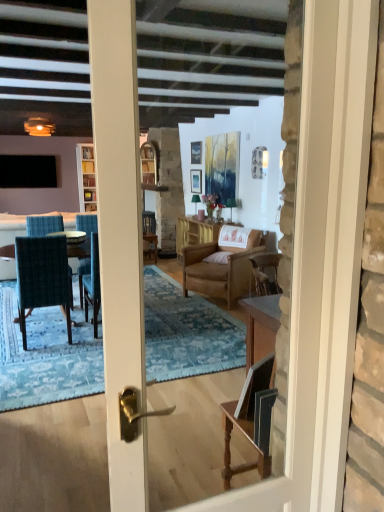
Question: Can you confirm if clear glass cabinet at center is taller than brown leather armchair at center, acting as the second chair starting from the front?

Choices:
 (A) yes
 (B) no

Answer: (B)

Question: From a real-world perspective, is clear glass cabinet at center on brown leather armchair at center, acting as the second chair starting from the front?

Choices:
 (A) no
 (B) yes

Answer: (B)

Question: Is clear glass cabinet at center completely or partially outside of brown leather armchair at center, marked as the second chair in a left-to-right arrangement?

Choices:
 (A) no
 (B) yes

Answer: (B)

Question: Is clear glass cabinet at center wider than brown leather armchair at center, marked as the 1th chair in a back-to-front arrangement?

Choices:
 (A) no
 (B) yes

Answer: (A)

Question: From the image's perspective, is clear glass cabinet at center located above brown leather armchair at center, acting as the second chair starting from the front?

Choices:
 (A) yes
 (B) no

Answer: (A)

Question: Is clear glass cabinet at center aimed at brown leather armchair at center, marked as the 1th chair in a back-to-front arrangement?

Choices:
 (A) yes
 (B) no

Answer: (B)

Question: Does teal fabric chair at left, placed as the first chair when sorted from left to right, appear on the right side of matte wooden picture frame at center, which is counted as the 2th picture frame, starting from the top?

Choices:
 (A) no
 (B) yes

Answer: (A)

Question: Is matte wooden picture frame at center, which is counted as the 2th picture frame, starting from the top, completely or partially inside teal fabric chair at left, placed as the first chair when sorted from left to right?

Choices:
 (A) yes
 (B) no

Answer: (B)

Question: From the image's perspective, is teal fabric chair at left, the 2th chair positioned from the right, under matte wooden picture frame at center, the first picture frame from the bottom?

Choices:
 (A) yes
 (B) no

Answer: (A)

Question: Does teal fabric chair at left, placed as the first chair when sorted from left to right, have a lesser height compared to matte wooden picture frame at center, which is counted as the 2th picture frame, starting from the top?

Choices:
 (A) no
 (B) yes

Answer: (A)

Question: Is teal fabric chair at left, the 2th chair positioned from the right, further to the viewer compared to matte wooden picture frame at center, which is counted as the 2th picture frame, starting from the top?

Choices:
 (A) yes
 (B) no

Answer: (B)

Question: Is teal fabric chair at left, placed as the first chair when sorted from left to right, thinner than matte wooden picture frame at center, the first picture frame from the bottom?

Choices:
 (A) no
 (B) yes

Answer: (A)

Question: Does teal fabric chair at left, the 2th chair positioned from the right, contain matte glass candle at upper left?

Choices:
 (A) no
 (B) yes

Answer: (A)